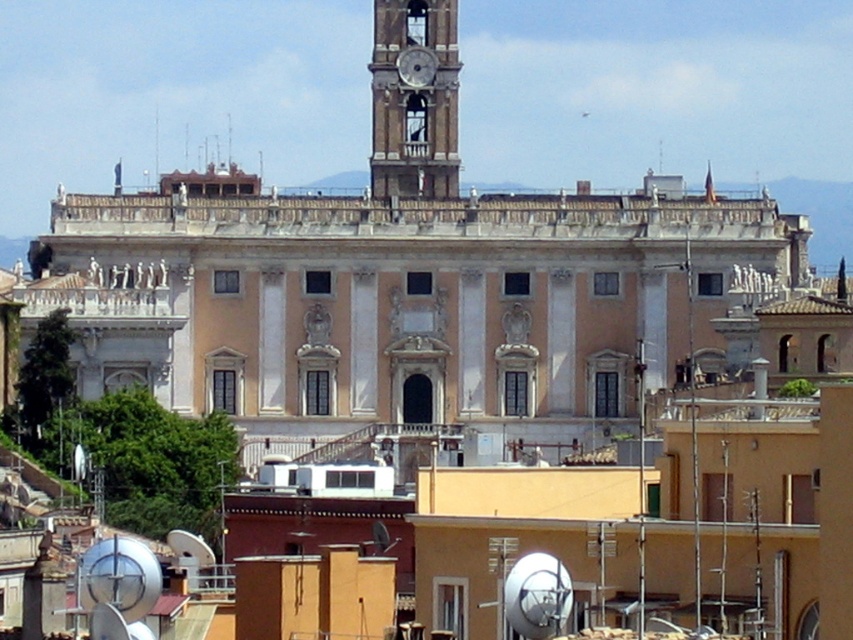
Question: In this image, where is smooth stone clock tower at center located relative to metallic silver clock at upper center?

Choices:
 (A) right
 (B) left

Answer: (B)

Question: Which point is closer to the camera?

Choices:
 (A) (405, 58)
 (B) (445, 180)

Answer: (B)

Question: Does smooth stone clock tower at center appear on the right side of metallic silver clock at upper center?

Choices:
 (A) yes
 (B) no

Answer: (B)

Question: Which object appears farthest from the camera in this image?

Choices:
 (A) metallic silver clock at upper center
 (B) smooth stone clock tower at center

Answer: (A)

Question: Can you confirm if smooth stone clock tower at center is bigger than metallic silver clock at upper center?

Choices:
 (A) yes
 (B) no

Answer: (A)